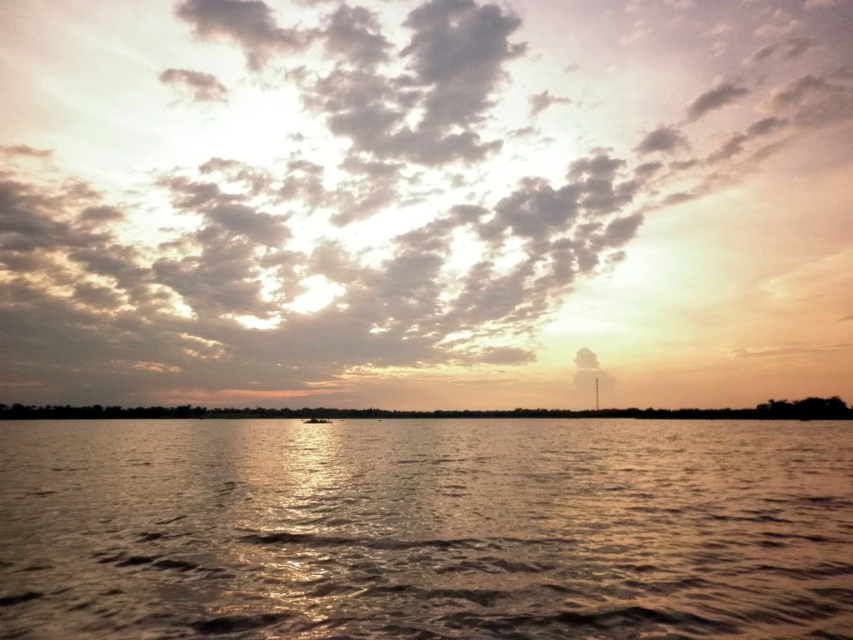
Question: Which object appears farthest from the camera in this image?

Choices:
 (A) sandy textured clouds at upper center
 (B) smooth brown boat at center

Answer: (A)

Question: Is glistening water at center to the right of brown matte land at lower center from the viewer's perspective?

Choices:
 (A) no
 (B) yes

Answer: (A)

Question: Which point is closer to the camera?

Choices:
 (A) brown matte land at lower center
 (B) smooth brown boat at center
 (C) sandy textured clouds at upper center

Answer: (B)

Question: Does glistening water at center appear on the right side of brown matte land at lower center?

Choices:
 (A) no
 (B) yes

Answer: (A)

Question: Considering the real-world distances, which object is closest to the brown matte land at lower center?

Choices:
 (A) smooth brown boat at center
 (B) glistening water at center
 (C) sandy textured clouds at upper center

Answer: (A)

Question: In this image, where is sandy textured clouds at upper center located relative to brown matte land at lower center?

Choices:
 (A) left
 (B) right

Answer: (A)